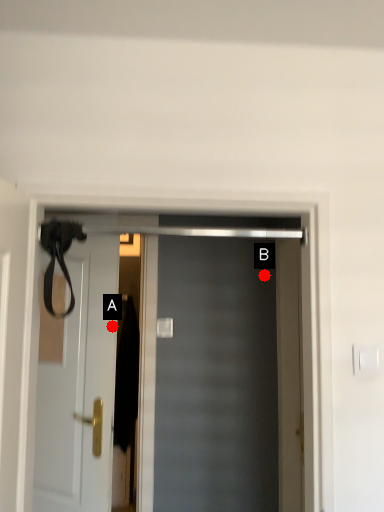
Question: Two points are circled on the image, labeled by A and B beside each circle. Which point is farther to the camera?

Choices:
 (A) A is further
 (B) B is further

Answer: (B)